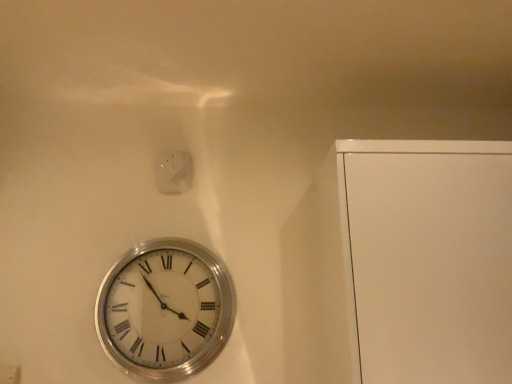
Question: Would you say white glossy electric outlet at upper center is to the left or to the right of silver metallic clock at lower left in the picture?

Choices:
 (A) left
 (B) right

Answer: (A)

Question: Is point (161, 190) closer or farther from the camera than point (186, 309)?

Choices:
 (A) closer
 (B) farther

Answer: (B)

Question: Looking at their shapes, would you say white glossy electric outlet at upper center is wider or thinner than silver metallic clock at lower left?

Choices:
 (A) wide
 (B) thin

Answer: (B)

Question: Based on their sizes in the image, would you say silver metallic clock at lower left is bigger or smaller than white glossy electric outlet at upper center?

Choices:
 (A) big
 (B) small

Answer: (A)

Question: From a real-world perspective, is silver metallic clock at lower left physically located above or below white glossy electric outlet at upper center?

Choices:
 (A) above
 (B) below

Answer: (B)

Question: From their relative heights in the image, would you say silver metallic clock at lower left is taller or shorter than white glossy electric outlet at upper center?

Choices:
 (A) tall
 (B) short

Answer: (A)

Question: Is silver metallic clock at lower left in front of or behind white glossy electric outlet at upper center in the image?

Choices:
 (A) front
 (B) behind

Answer: (A)